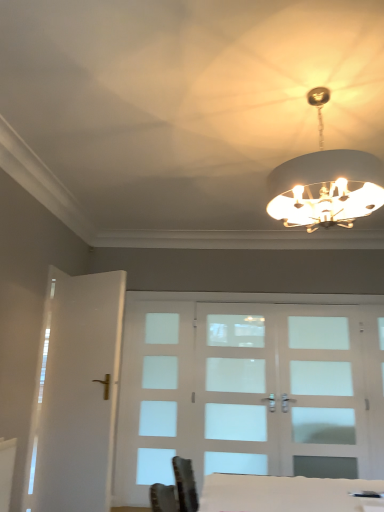
Describe the element at coordinates (76, 393) in the screenshot. The image size is (384, 512). I see `white glossy door at left, arranged as the first screen door when viewed from the left` at that location.

Image resolution: width=384 pixels, height=512 pixels. In order to click on white frosted glass door at center, which is the first screen door from right to left in this screenshot , I will do `click(325, 398)`.

Based on the photo, could you tell me if clear glass door at center, which is the second screen door from right to left, is turned towards white frosted glass door at center, the 3th screen door when ordered from left to right?

No, clear glass door at center, which is the second screen door from right to left, is not facing towards white frosted glass door at center, the 3th screen door when ordered from left to right.

From a real-world perspective, is clear glass door at center, which is the second screen door from left to right, beneath white frosted glass door at center, which is the first screen door from right to left?

Correct, in the physical world, clear glass door at center, which is the second screen door from left to right, is lower than white frosted glass door at center, which is the first screen door from right to left.

Is clear glass door at center, which is the second screen door from left to right, in front of or behind white frosted glass door at center, which is the first screen door from right to left, in the image?

clear glass door at center, which is the second screen door from left to right, is positioned farther from the viewer than white frosted glass door at center, which is the first screen door from right to left.

Considering the sizes of objects clear glass door at center, which is the second screen door from left to right, and white frosted glass door at center, which is the first screen door from right to left, in the image provided, who is smaller, clear glass door at center, which is the second screen door from left to right, or white frosted glass door at center, which is the first screen door from right to left,?

white frosted glass door at center, which is the first screen door from right to left.

Is white glass chandelier at upper center taller or shorter than white glossy door at left, the 3th screen door viewed from the right?

Considering their sizes, white glass chandelier at upper center has less height than white glossy door at left, the 3th screen door viewed from the right.

How far apart are white glass chandelier at upper center and white glossy door at left, arranged as the first screen door when viewed from the left?

white glass chandelier at upper center and white glossy door at left, arranged as the first screen door when viewed from the left, are 1.99 meters apart from each other.

From the image's perspective, is white glass chandelier at upper center on white glossy door at left, arranged as the first screen door when viewed from the left?

Yes, from the image's perspective, white glass chandelier at upper center is over white glossy door at left, arranged as the first screen door when viewed from the left.

Is white glass chandelier at upper center smaller than white glossy door at left, arranged as the first screen door when viewed from the left?

No, white glass chandelier at upper center is not smaller than white glossy door at left, arranged as the first screen door when viewed from the left.

Is white frosted glass door at center, the 3th screen door when ordered from left to right, thinner than white glossy door at left, arranged as the first screen door when viewed from the left?

Correct, the width of white frosted glass door at center, the 3th screen door when ordered from left to right, is less than that of white glossy door at left, arranged as the first screen door when viewed from the left.

Between point (333, 424) and point (67, 383), which one is positioned in front?

Point (67, 383)

There is a white frosted glass door at center, the 3th screen door when ordered from left to right. Where is `the 1st screen door below it (from a real-world perspective)`? The image size is (384, 512). the 1st screen door below it (from a real-world perspective) is located at coordinates (76, 393).

From a real-world perspective, is white frosted glass door at center, which is the first screen door from right to left, physically located above or below white glossy door at left, arranged as the first screen door when viewed from the left?

Clearly, from a real-world perspective, white frosted glass door at center, which is the first screen door from right to left, is above white glossy door at left, arranged as the first screen door when viewed from the left.

Considering the relative sizes of white glossy table at lower center and white glossy door at left, the 3th screen door viewed from the right, in the image provided, is white glossy table at lower center taller than white glossy door at left, the 3th screen door viewed from the right,?

No, white glossy table at lower center is not taller than white glossy door at left, the 3th screen door viewed from the right.

Is white glossy table at lower center further to the viewer compared to white glossy door at left, the 3th screen door viewed from the right?

No.

Is white glossy table at lower center completely or partially outside of white glossy door at left, arranged as the first screen door when viewed from the left?

Absolutely, white glossy table at lower center is external to white glossy door at left, arranged as the first screen door when viewed from the left.

Considering the relative positions of white glossy table at lower center and white glossy door at left, the 3th screen door viewed from the right, in the image provided, is white glossy table at lower center to the left of white glossy door at left, the 3th screen door viewed from the right, from the viewer's perspective?

In fact, white glossy table at lower center is to the right of white glossy door at left, the 3th screen door viewed from the right.

Is white glossy table at lower center wider or thinner than white frosted glass door at center, which is the first screen door from right to left?

white glossy table at lower center is wider than white frosted glass door at center, which is the first screen door from right to left.

Considering the positions of point (234, 504) and point (322, 374), is point (234, 504) closer or farther from the camera than point (322, 374)?

Point (234, 504) appears to be closer to the viewer than point (322, 374).

Could you measure the distance between white glossy table at lower center and white frosted glass door at center, the 3th screen door when ordered from left to right?

A distance of 7.14 feet exists between white glossy table at lower center and white frosted glass door at center, the 3th screen door when ordered from left to right.

In the image, is white glossy table at lower center on the left side or the right side of white frosted glass door at center, the 3th screen door when ordered from left to right?

From the image, it's evident that white glossy table at lower center is to the left of white frosted glass door at center, the 3th screen door when ordered from left to right.

Is white glossy door at left, the 3th screen door viewed from the right, positioned before white frosted glass door at center, which is the first screen door from right to left?

Yes, white glossy door at left, the 3th screen door viewed from the right, is closer to the camera.

Which of these two, white glossy door at left, the 3th screen door viewed from the right, or white frosted glass door at center, the 3th screen door when ordered from left to right, is wider?

With larger width is white glossy door at left, the 3th screen door viewed from the right.

Considering the sizes of white glossy door at left, the 3th screen door viewed from the right, and white frosted glass door at center, which is the first screen door from right to left, in the image, is white glossy door at left, the 3th screen door viewed from the right, bigger or smaller than white frosted glass door at center, which is the first screen door from right to left,?

white glossy door at left, the 3th screen door viewed from the right, is bigger than white frosted glass door at center, which is the first screen door from right to left.

In the scene shown: Is white glossy door at left, the 3th screen door viewed from the right, aimed at white frosted glass door at center, which is the first screen door from right to left?

No, white glossy door at left, the 3th screen door viewed from the right, does not turn towards white frosted glass door at center, which is the first screen door from right to left.

Is white frosted glass door at center, the 3th screen door when ordered from left to right, far from clear glass door at center, which is the second screen door from left to right?

Actually, white frosted glass door at center, the 3th screen door when ordered from left to right, and clear glass door at center, which is the second screen door from left to right, are a little close together.

Which of these two, white frosted glass door at center, which is the first screen door from right to left, or clear glass door at center, which is the second screen door from left to right, is thinner?

Thinner between the two is clear glass door at center, which is the second screen door from left to right.

Which is in front, point (333, 319) or point (262, 441)?

The point (262, 441) is closer to the camera.

From the image's perspective, which one is positioned lower, white frosted glass door at center, the 3th screen door when ordered from left to right, or clear glass door at center, which is the second screen door from right to left?

clear glass door at center, which is the second screen door from right to left, from the image's perspective.

At what (x,y) coordinates should I click in order to perform the action: click on the 1st screen door above the clear glass door at center, which is the second screen door from right to left (from the image's perspective). Please return your answer as a coordinate pair (x, y). Image resolution: width=384 pixels, height=512 pixels. Looking at the image, I should click on (325, 398).

Where is `the 2nd screen door to the left when counting from the white glass chandelier at upper center`? The height and width of the screenshot is (512, 384). the 2nd screen door to the left when counting from the white glass chandelier at upper center is located at coordinates (76, 393).

Looking at the image, which one is located closer to white glossy table at lower center, white glossy door at left, arranged as the first screen door when viewed from the left, or clear glass door at center, which is the second screen door from right to left?

white glossy door at left, arranged as the first screen door when viewed from the left, lies closer to white glossy table at lower center than the other object.

Which object lies further to the anchor point clear glass door at center, which is the second screen door from left to right, white glossy door at left, the 3th screen door viewed from the right, or white glossy table at lower center?

white glossy table at lower center lies further to clear glass door at center, which is the second screen door from left to right, than the other object.

From the image, which object appears to be farther from white frosted glass door at center, the 3th screen door when ordered from left to right, clear glass door at center, which is the second screen door from right to left, or white glossy table at lower center?

white glossy table at lower center.

From the image, which object appears to be farther from white glossy table at lower center, white glass chandelier at upper center or white glossy door at left, arranged as the first screen door when viewed from the left?

white glossy door at left, arranged as the first screen door when viewed from the left, is further to white glossy table at lower center.

Based on their spatial positions, is white glossy door at left, arranged as the first screen door when viewed from the left, or white frosted glass door at center, the 3th screen door when ordered from left to right, closer to clear glass door at center, which is the second screen door from right to left?

white frosted glass door at center, the 3th screen door when ordered from left to right, lies closer to clear glass door at center, which is the second screen door from right to left, than the other object.

From the image, which object appears to be nearer to clear glass door at center, which is the second screen door from left to right, white frosted glass door at center, the 3th screen door when ordered from left to right, or white glass chandelier at upper center?

Among the two, white frosted glass door at center, the 3th screen door when ordered from left to right, is located nearer to clear glass door at center, which is the second screen door from left to right.

Estimate the real-world distances between objects in this image. Which object is closer to white glass chandelier at upper center, white glossy table at lower center or white frosted glass door at center, which is the first screen door from right to left?

white glossy table at lower center lies closer to white glass chandelier at upper center than the other object.

Estimate the real-world distances between objects in this image. Which object is further from white glossy door at left, the 3th screen door viewed from the right, white glossy table at lower center or white glass chandelier at upper center?

The object further to white glossy door at left, the 3th screen door viewed from the right, is white glass chandelier at upper center.

I want to click on screen door positioned between white glossy table at lower center and white frosted glass door at center, which is the first screen door from right to left, from near to far, so pos(76,393).

Locate an element on the screen. lamp between white glossy door at left, arranged as the first screen door when viewed from the left, and white frosted glass door at center, which is the first screen door from right to left is located at coordinates (325, 183).

Where is `screen door situated between white glossy door at left, arranged as the first screen door when viewed from the left, and white frosted glass door at center, the 3th screen door when ordered from left to right, from left to right`? This screenshot has width=384, height=512. screen door situated between white glossy door at left, arranged as the first screen door when viewed from the left, and white frosted glass door at center, the 3th screen door when ordered from left to right, from left to right is located at coordinates (236, 391).

Where is `lamp between white glossy table at lower center and clear glass door at center, which is the second screen door from right to left, along the z-axis`? The height and width of the screenshot is (512, 384). lamp between white glossy table at lower center and clear glass door at center, which is the second screen door from right to left, along the z-axis is located at coordinates (325, 183).